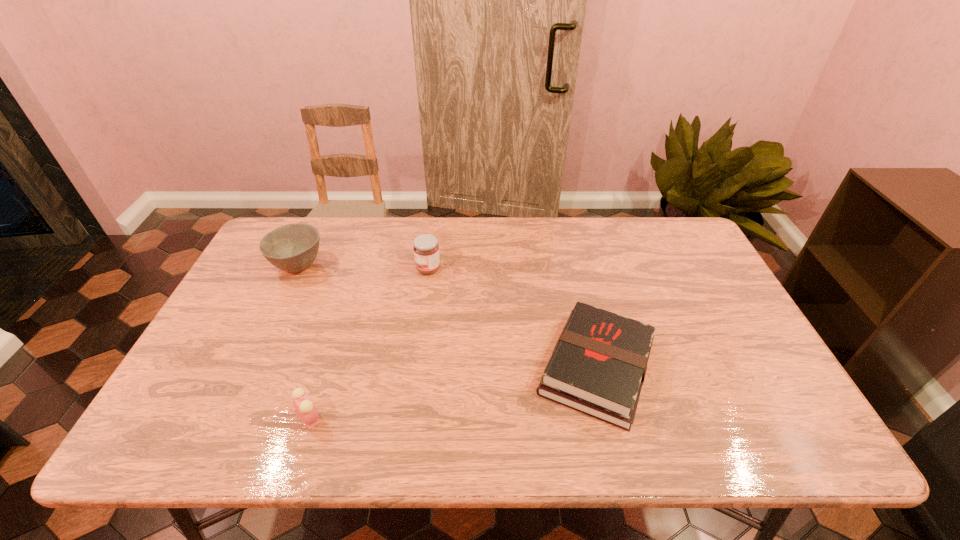
This screenshot has width=960, height=540. What are the coordinates of `free space between the rightmost object and the bowl` in the screenshot? It's located at (447, 316).

Find the location of a particular element. Image resolution: width=960 pixels, height=540 pixels. vacant area that lies between the bowl and the second object from right to left is located at coordinates (363, 267).

Where is `vacant point located between the second object from left to right and the third object from left to right`? The height and width of the screenshot is (540, 960). vacant point located between the second object from left to right and the third object from left to right is located at coordinates (370, 343).

Where is `vacant area that lies between the rightmost object and the jam`? vacant area that lies between the rightmost object and the jam is located at coordinates (513, 319).

Where is `free space between the alarm clock and the bowl`? Image resolution: width=960 pixels, height=540 pixels. free space between the alarm clock and the bowl is located at coordinates (304, 341).

Find the location of `free spot between the rightmost object and the alarm clock`. free spot between the rightmost object and the alarm clock is located at coordinates (453, 393).

Locate an element on the screen. free spot between the second object from right to left and the hardback book is located at coordinates (513, 319).

Identify the location of object that stands as the closest to the alarm clock. (293, 247).

This screenshot has width=960, height=540. I want to click on the closest object to the second object from right to left, so click(x=293, y=247).

The width and height of the screenshot is (960, 540). Find the location of `free region that satisfies the following two spatial constraints: 1. on the front side of the third object from left to right; 2. on the face of the third object from right to left`. free region that satisfies the following two spatial constraints: 1. on the front side of the third object from left to right; 2. on the face of the third object from right to left is located at coordinates (408, 418).